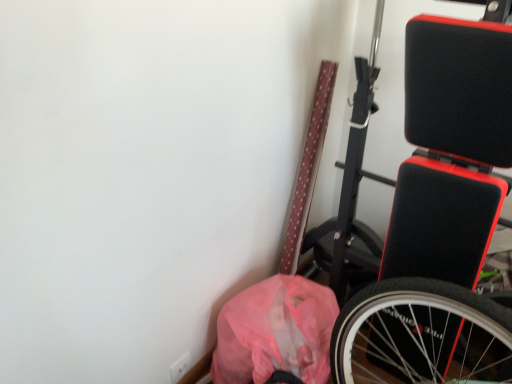
Question: Should I look upward or downward to see black matte exercise bench at right?

Choices:
 (A) down
 (B) up

Answer: (A)

Question: Is pink plastic bag at lower right at the right side of black matte exercise bench at right?

Choices:
 (A) yes
 (B) no

Answer: (B)

Question: Does pink plastic bag at lower right have a lesser width compared to black matte exercise bench at right?

Choices:
 (A) yes
 (B) no

Answer: (A)

Question: Does pink plastic bag at lower right appear on the left side of black matte exercise bench at right?

Choices:
 (A) yes
 (B) no

Answer: (A)

Question: Is pink plastic bag at lower right wider than black matte exercise bench at right?

Choices:
 (A) no
 (B) yes

Answer: (A)

Question: Is pink plastic bag at lower right smaller than black matte exercise bench at right?

Choices:
 (A) yes
 (B) no

Answer: (A)

Question: Is pink plastic bag at lower right far from black matte exercise bench at right?

Choices:
 (A) no
 (B) yes

Answer: (A)

Question: Is black matte exercise bench at right taller than pink plastic bag at lower right?

Choices:
 (A) no
 (B) yes

Answer: (B)

Question: Is the depth of black matte exercise bench at right greater than that of pink plastic bag at lower right?

Choices:
 (A) no
 (B) yes

Answer: (A)

Question: Considering the relative sizes of black matte exercise bench at right and pink plastic bag at lower right in the image provided, is black matte exercise bench at right wider than pink plastic bag at lower right?

Choices:
 (A) no
 (B) yes

Answer: (B)

Question: Can you confirm if black matte exercise bench at right is thinner than pink plastic bag at lower right?

Choices:
 (A) yes
 (B) no

Answer: (B)

Question: From a real-world perspective, is black matte exercise bench at right below pink plastic bag at lower right?

Choices:
 (A) yes
 (B) no

Answer: (B)

Question: Considering the relative sizes of black matte exercise bench at right and pink plastic bag at lower right in the image provided, is black matte exercise bench at right smaller than pink plastic bag at lower right?

Choices:
 (A) yes
 (B) no

Answer: (B)

Question: Would you say black matte exercise bench at right is to the left or to the right of pink plastic bag at lower right in the picture?

Choices:
 (A) right
 (B) left

Answer: (A)